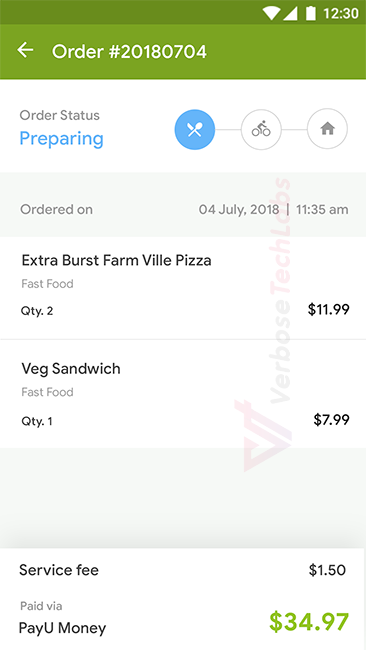
You are a GUI agent. You are given a task and a screenshot of the screen. Output one action in this format:
    pyautogui.click(x=<x>, y=<y>)
    Task: Click on the wifi
    
    Given the screenshot: What is the action you would take?
    pyautogui.click(x=272, y=8)